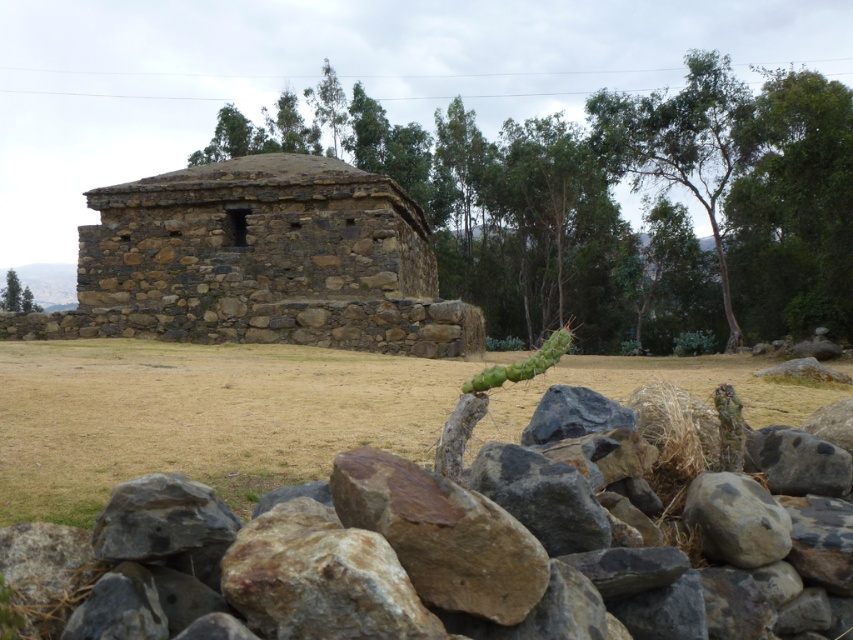
Question: Is brown stone building at center closer to camera compared to green grass at center?

Choices:
 (A) yes
 (B) no

Answer: (B)

Question: Among these objects, which one is nearest to the camera?

Choices:
 (A) green leafy tree at upper left
 (B) brown stone building at center
 (C) green grass at center

Answer: (C)

Question: Which point is closer to the camera taking this photo?

Choices:
 (A) (152, 417)
 (B) (6, 280)
 (C) (776, 124)
 (D) (181, 314)

Answer: (A)

Question: Is the position of brown stone building at center less distant than that of brown stone hut at center?

Choices:
 (A) no
 (B) yes

Answer: (A)

Question: Which of the following is the closest to the observer?

Choices:
 (A) green leafy tree at upper left
 (B) green grass at center
 (C) brown stone building at center

Answer: (B)

Question: Where is brown stone building at center located in relation to brown stone hut at center in the image?

Choices:
 (A) left
 (B) right

Answer: (B)